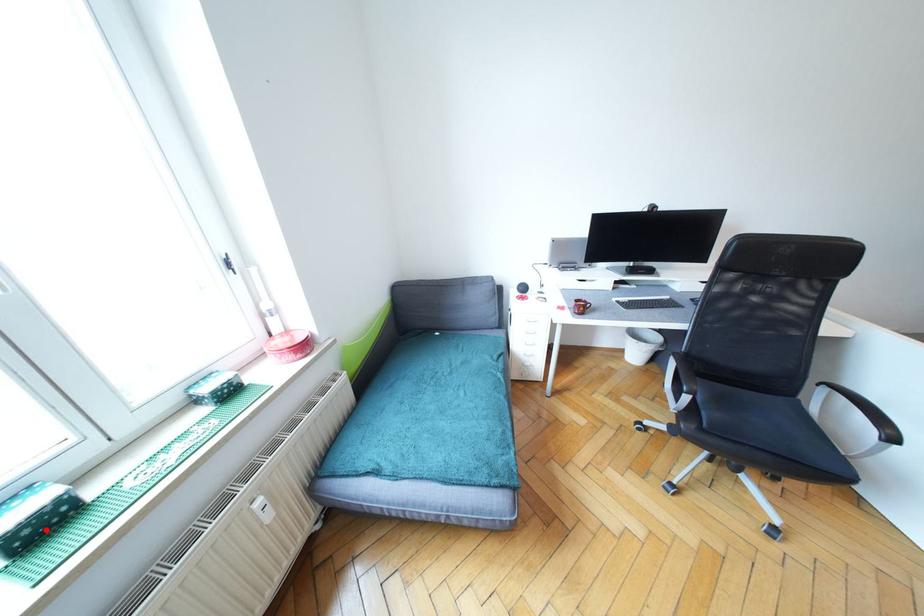
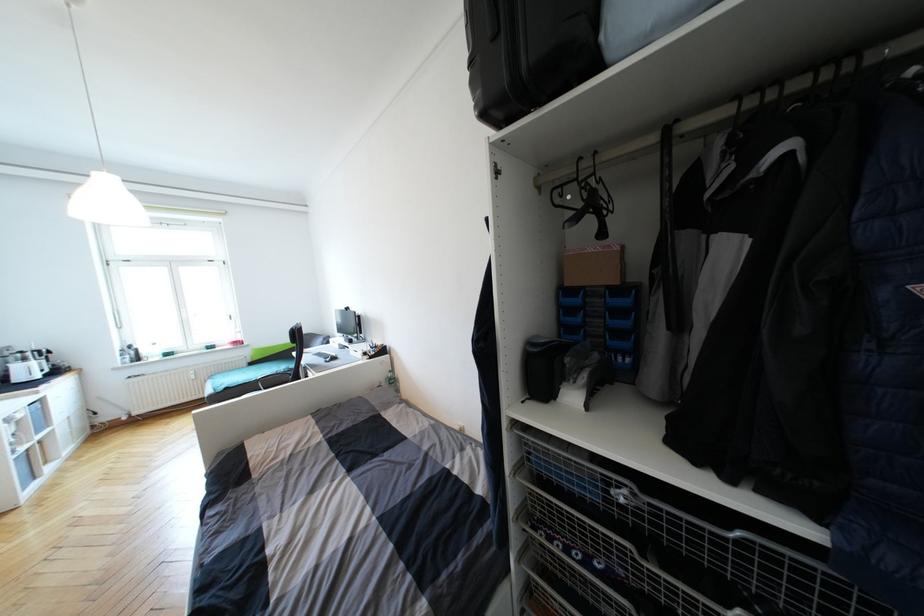
Locate, in the second image, the point that corresponds to the highlighted location in the first image.

(171, 357)